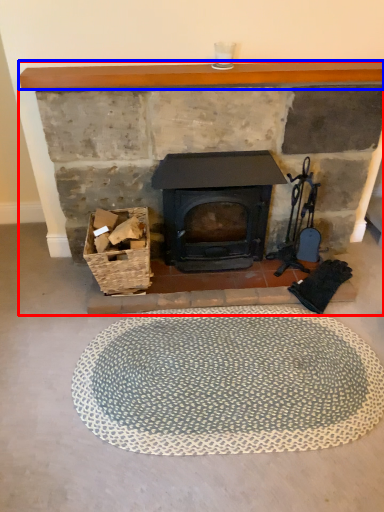
Question: Which of the following is the farthest to the observer, fireplace (highlighted by a red box) or balustrade (highlighted by a blue box)?

Choices:
 (A) fireplace
 (B) balustrade

Answer: (A)